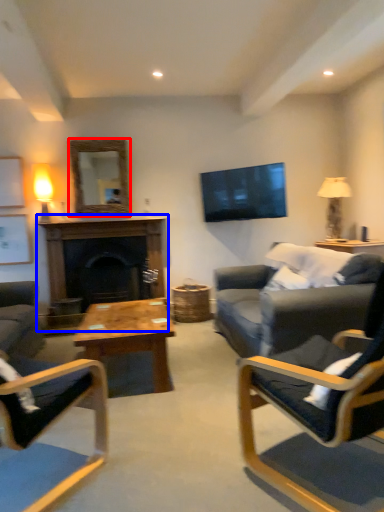
Question: Which object is closer to the camera taking this photo, mirror (highlighted by a red box) or fireplace (highlighted by a blue box)?

Choices:
 (A) mirror
 (B) fireplace

Answer: (B)